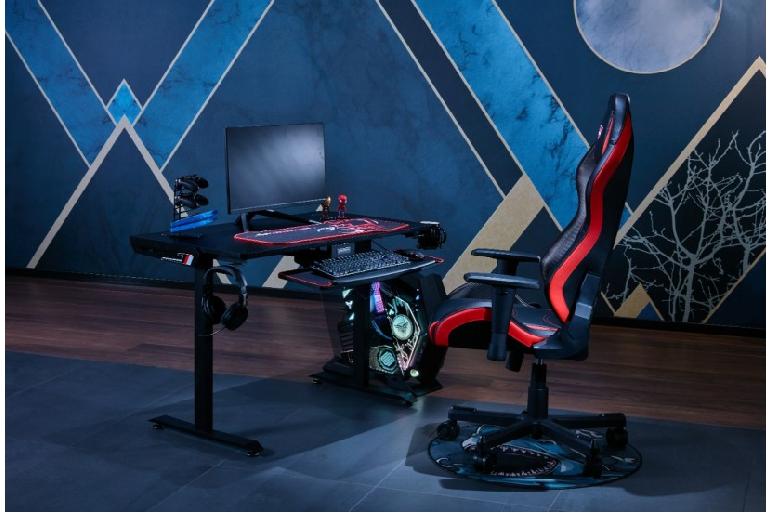
Where is `computer tower with led lights inside of it`? computer tower with led lights inside of it is located at coordinates (389, 318).